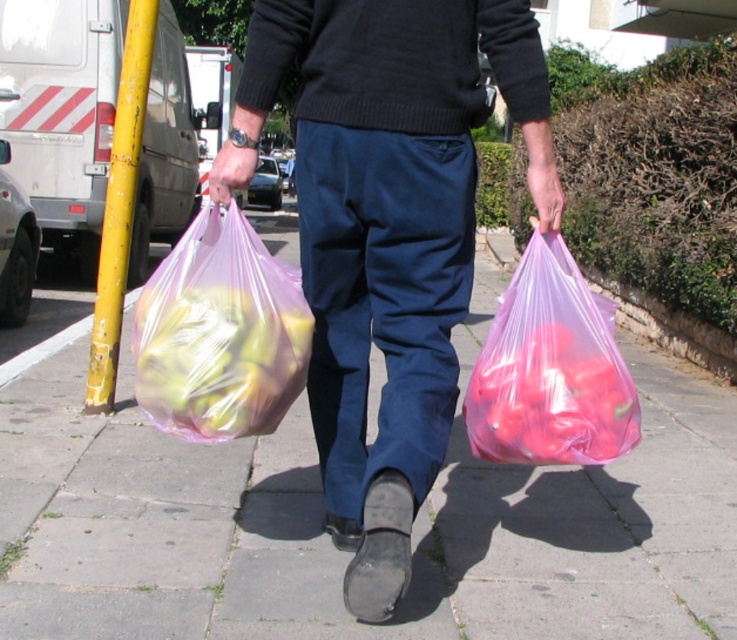
Question: Does translucent plastic bag at center appear on the left side of translucent pink plastic bag at lower right?

Choices:
 (A) no
 (B) yes

Answer: (B)

Question: Which object appears closest to the camera in this image?

Choices:
 (A) translucent plastic bag at center
 (B) transparent plastic bag at center
 (C) translucent plastic bag at left

Answer: (B)

Question: Can you confirm if transparent plastic bag at center is smaller than yellow painted metal pole at left?

Choices:
 (A) yes
 (B) no

Answer: (B)

Question: Estimate the real-world distances between objects in this image. Which object is farther from the yellow painted metal pole at left?

Choices:
 (A) translucent plastic bag at left
 (B) translucent pink plastic bag at lower right
 (C) white matte van at left
 (D) transparent plastic bag at center

Answer: (C)

Question: Based on their relative distances, which object is farther from the translucent plastic bag at left?

Choices:
 (A) transparent plastic bag at center
 (B) translucent pink plastic bag at lower right
 (C) yellow painted metal pole at left
 (D) white matte van at left

Answer: (D)

Question: Does translucent plastic bag at left appear on the right side of yellow painted metal pole at left?

Choices:
 (A) no
 (B) yes

Answer: (B)